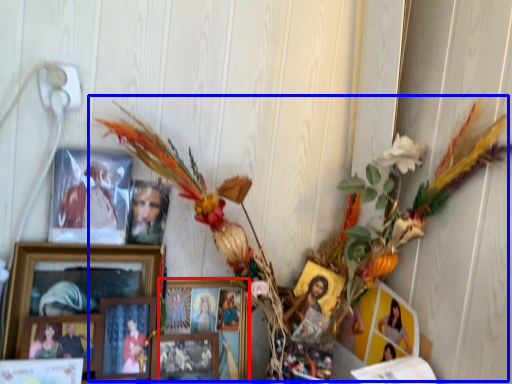
Question: Which object is closer to the camera taking this photo, picture frame (highlighted by a red box) or floral arrangement (highlighted by a blue box)?

Choices:
 (A) picture frame
 (B) floral arrangement

Answer: (B)